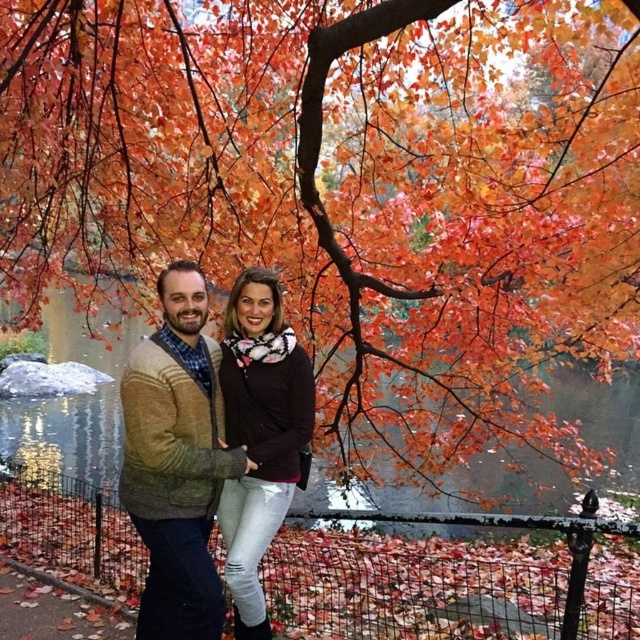
Does knit sweater at center have a larger size compared to matte black sweater at center?

Correct, knit sweater at center is larger in size than matte black sweater at center.

Does knit sweater at center have a smaller size compared to matte black sweater at center?

Incorrect, knit sweater at center is not smaller in size than matte black sweater at center.

Describe the element at coordinates (177, 460) in the screenshot. I see `knit sweater at center` at that location.

This screenshot has height=640, width=640. In order to click on knit sweater at center in this screenshot , I will do `click(177, 460)`.